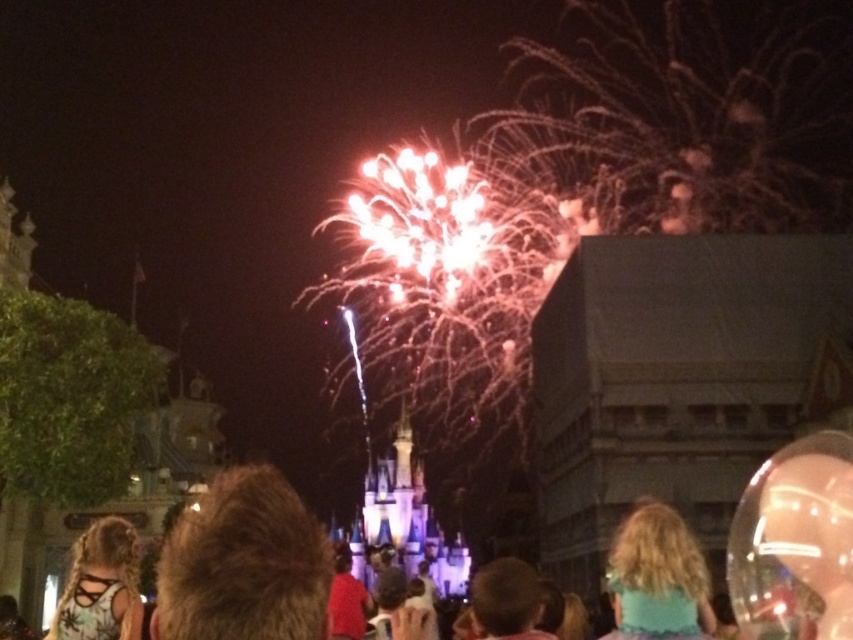
This screenshot has height=640, width=853. I want to click on matte black tank top at lower left, so [102, 586].

Can you confirm if matte black tank top at lower left is positioned above brown hair at center?

Correct, matte black tank top at lower left is located above brown hair at center.

Between point (83, 582) and point (496, 620), which one is positioned in front?

Point (83, 582) is in front.

The width and height of the screenshot is (853, 640). What are the coordinates of `matte black tank top at lower left` in the screenshot? It's located at 102,586.

Is the position of brown fuzzy hair at center less distant than that of matte black tank top at lower left?

Yes, brown fuzzy hair at center is closer to the viewer.

Does brown fuzzy hair at center have a greater height compared to matte black tank top at lower left?

Correct, brown fuzzy hair at center is much taller as matte black tank top at lower left.

This screenshot has width=853, height=640. In order to click on brown fuzzy hair at center in this screenshot , I will do `click(244, 563)`.

Between brown fuzzy hair at center and teal fabric hair at center, which one appears on the right side from the viewer's perspective?

teal fabric hair at center is more to the right.

Can you confirm if brown fuzzy hair at center is positioned above teal fabric hair at center?

Yes, brown fuzzy hair at center is above teal fabric hair at center.

I want to click on brown fuzzy hair at center, so click(244, 563).